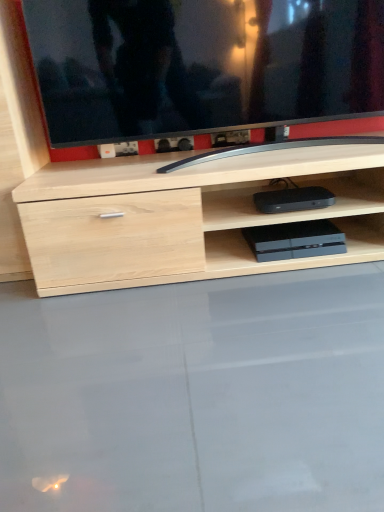
Question: From the image's perspective, relative to slate gray plastic game console at lower center, which is counted as the first equipment, starting from the bottom, is transparent glass table at lower center above or below?

Choices:
 (A) below
 (B) above

Answer: (A)

Question: Is transparent glass table at lower center bigger or smaller than slate gray plastic game console at lower center, the second equipment when ordered from top to bottom?

Choices:
 (A) big
 (B) small

Answer: (A)

Question: Which of these objects is positioned farthest from the transparent glass table at lower center?

Choices:
 (A) black plastic device at center, placed as the first equipment when sorted from top to bottom
 (B) black glossy tv at upper center
 (C) slate gray plastic game console at lower center, which is counted as the first equipment, starting from the bottom

Answer: (B)

Question: Based on their relative distances, which object is farther from the slate gray plastic game console at lower center, which is counted as the first equipment, starting from the bottom?

Choices:
 (A) transparent glass table at lower center
 (B) black glossy tv at upper center
 (C) black plastic device at center, the 2th equipment when ordered from bottom to top

Answer: (B)